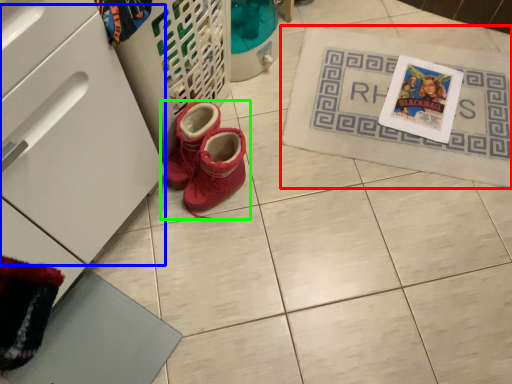
Question: Estimate the real-world distances between objects in this image. Which object is closer to bath mat (highlighted by a red box), drawer (highlighted by a blue box) or footwear (highlighted by a green box)?

Choices:
 (A) drawer
 (B) footwear

Answer: (B)